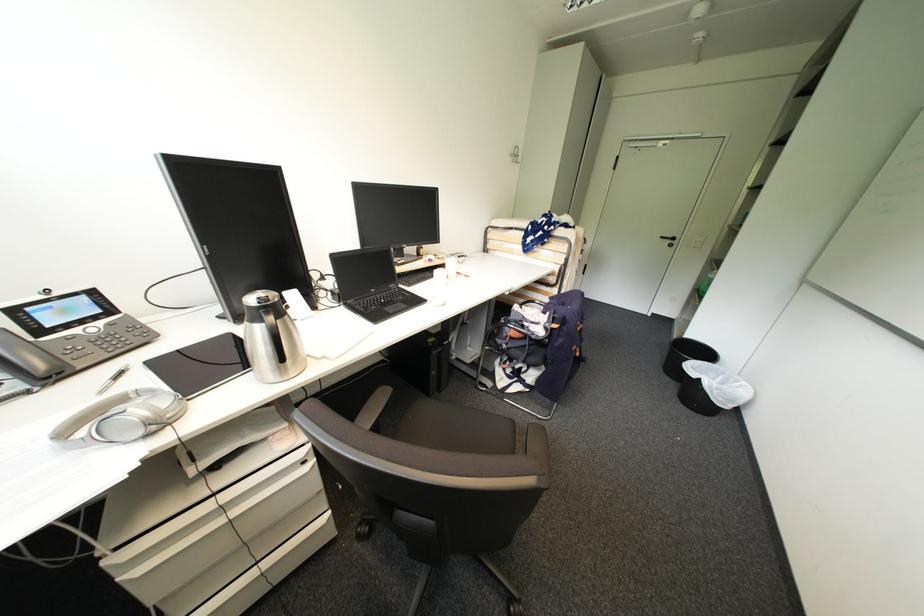
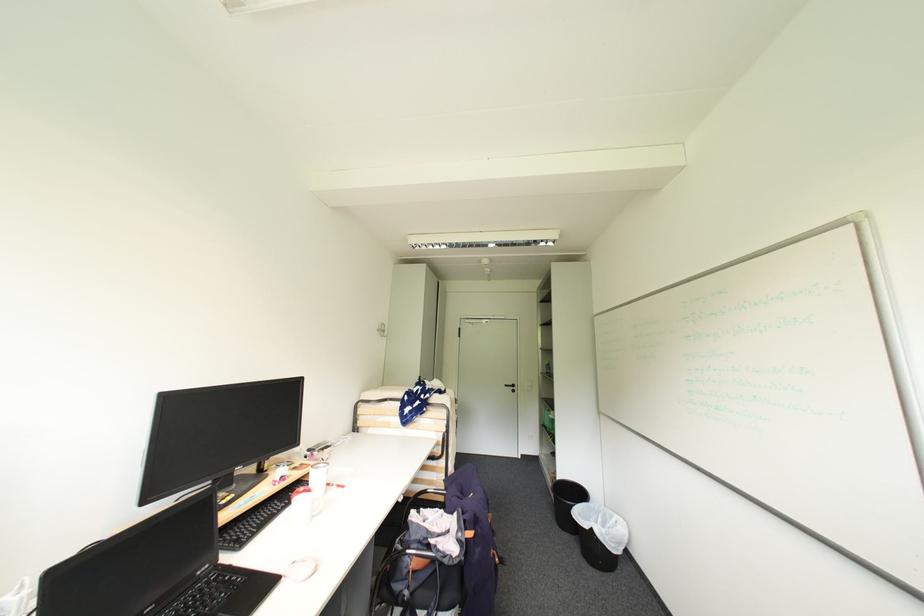
Locate, in the second image, the point that corresponds to pixel 669 238 in the first image.

(513, 387)